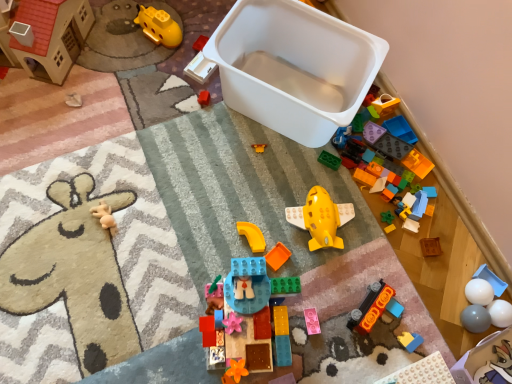
Locate an element on the screen. space that is in front of orange matte block at center, the 11th toy from the right is located at coordinates (288, 337).